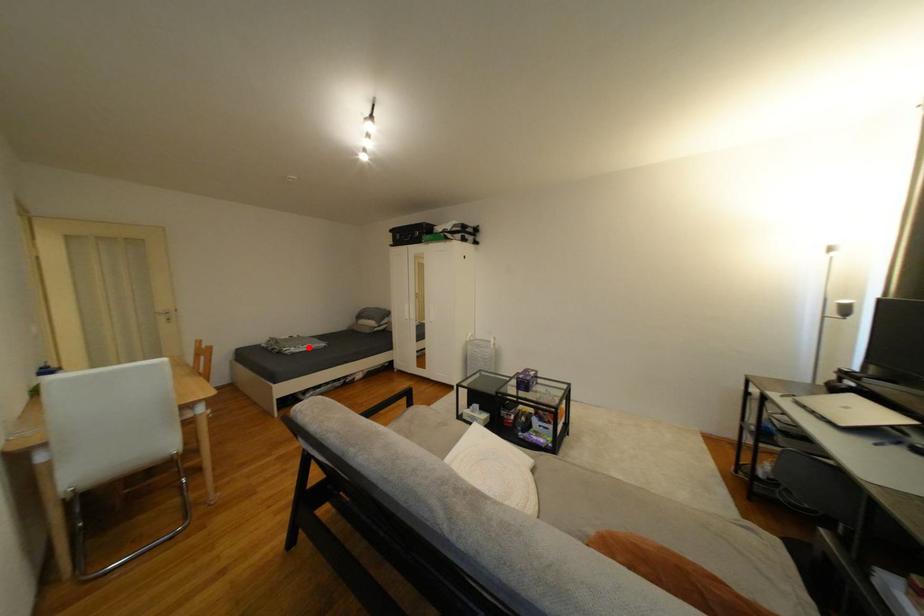
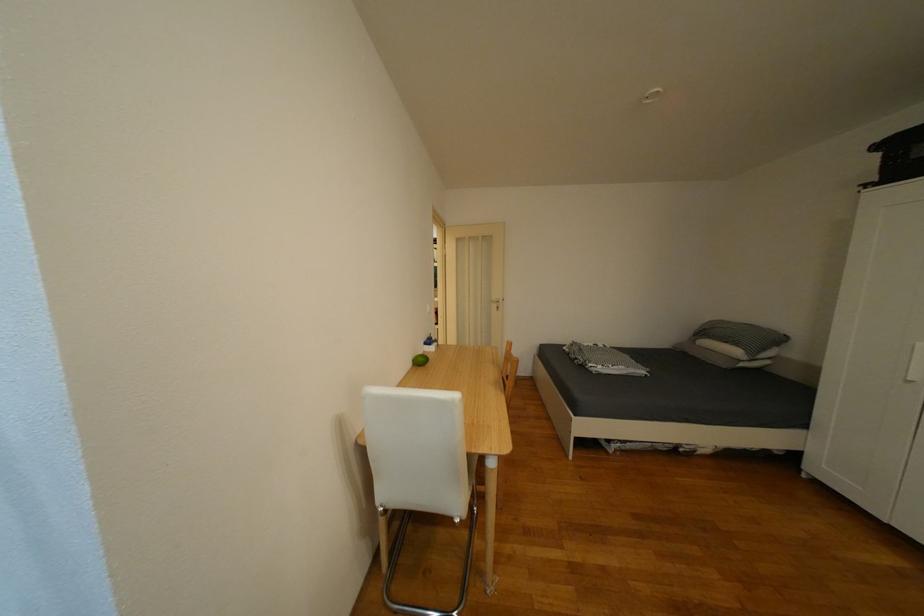
Locate, in the second image, the point that corresponds to the highlighted location in the first image.

(618, 368)